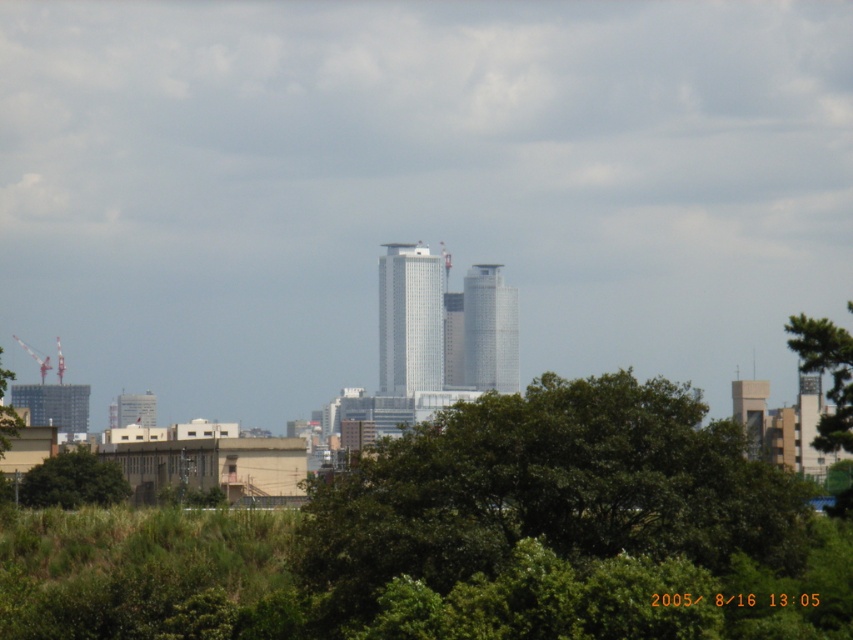
Question: Which of the following is the farthest from the observer?

Choices:
 (A) (318, 504)
 (B) (846, 417)

Answer: (B)

Question: Based on their relative distances, which object is nearer to the white glossy building at center?

Choices:
 (A) white glass building at upper center
 (B) green leafy tree at lower left
 (C) gray concrete building at lower left

Answer: (A)

Question: Does white glass building at center lie in front of white glossy building at center?

Choices:
 (A) no
 (B) yes

Answer: (B)

Question: Which object is the farthest from the green leafy tree at upper right?

Choices:
 (A) white glossy building at center
 (B) gray concrete building at lower left
 (C) white glass building at upper center

Answer: (B)

Question: Can you confirm if white glass building at center is thinner than gray concrete building at lower left?

Choices:
 (A) yes
 (B) no

Answer: (B)

Question: Does green leafy tree at center have a lesser width compared to white glossy building at center?

Choices:
 (A) yes
 (B) no

Answer: (B)